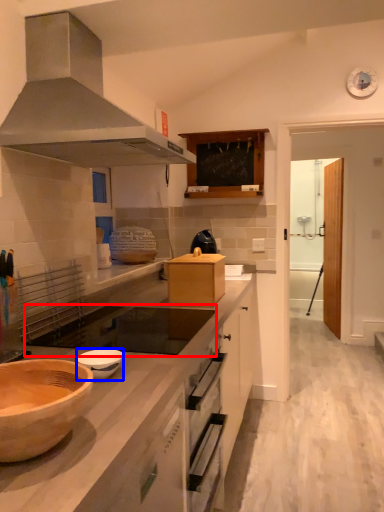
Question: Among these objects, which one is farthest to the camera, gas stove (highlighted by a red box) or bowl (highlighted by a blue box)?

Choices:
 (A) gas stove
 (B) bowl

Answer: (A)